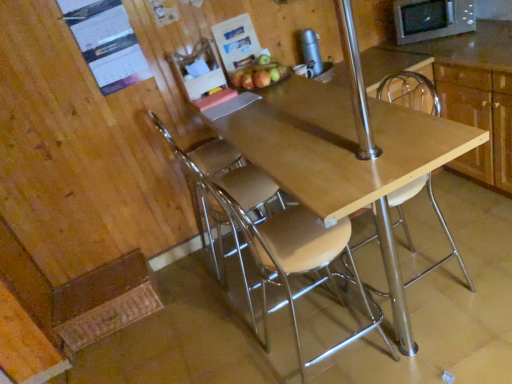
Find the location of `vacant area that is in front of light brown wood chair at center, which appears as the 1th chair when viewed from the right`. vacant area that is in front of light brown wood chair at center, which appears as the 1th chair when viewed from the right is located at coordinates (455, 341).